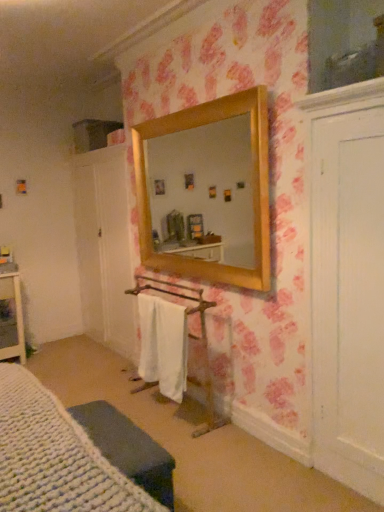
Question: Is white cotton bath towel at center wider or thinner than white knitted bed at lower left?

Choices:
 (A) wide
 (B) thin

Answer: (B)

Question: From the image's perspective, relative to white knitted bed at lower left, is white cotton bath towel at center above or below?

Choices:
 (A) above
 (B) below

Answer: (A)

Question: Estimate the real-world distances between objects in this image. Which object is closer to the knitted fabric cushion at lower left?

Choices:
 (A) white cotton bath towel at center
 (B) white knitted bed at lower left

Answer: (B)

Question: Which is farther from the knitted fabric cushion at lower left?

Choices:
 (A) white knitted bed at lower left
 (B) white cotton bath towel at center

Answer: (B)